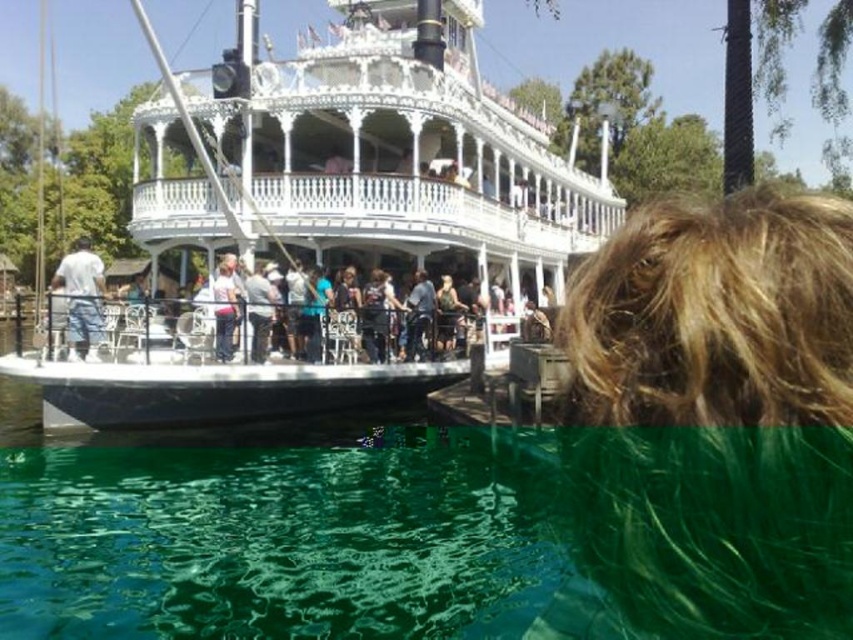
You are a tour guide leading a group at the water park. You need to inform your group about the distance between the white wooden boat at center and the white cotton shirt at left. How far apart are they?

The distance between the white wooden boat at center and the white cotton shirt at left is 159.19 feet.

You are standing on the wooden pier and want to take a photo of the paddlewheel boat. You notice two points marked on the boat at coordinates point (555, 182) and point (666, 573). Which point will appear closer to the camera in your photo?

Point (555, 182) is further to the camera than point (666, 573), so in the photo, point (555, 182) will appear closer to the camera.

You are standing on the wooden pier and want to board the white wooden boat at center. There is a white cotton shirt at left in your way. Since the boat is closer to you, can you walk around the shirt to reach the boat?

Yes, because the white wooden boat at center is closer to the viewer than the white cotton shirt at left, you can walk around the white cotton shirt at left to reach the boat.